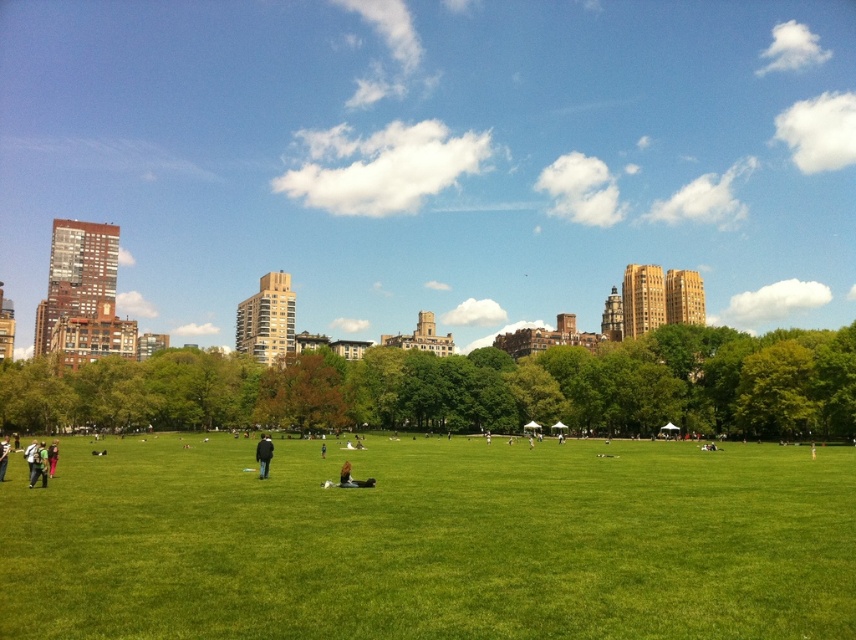
Looking at this image, you are a photographer standing in the urban park scene. You notice two jackets at the center of the image. Which jacket is closer to the camera, the dark gray jacket at center or the black leather jacket at center?

The dark gray jacket at center is closer to the camera because it is positioned under the black leather jacket at center, indicating it is in front.

You are standing at the origin point of the coordinate system in the park. You want to find the dark gray jacket at center. What are the coordinates where you should look to locate it?

The coordinates to locate the dark gray jacket at center are at point (263, 454).

You are standing in the urban park and see the green grass at center and the black leather jacket at center. Which object is closer to you?

The green grass at center is closer to you because it is in front of the black leather jacket at center.